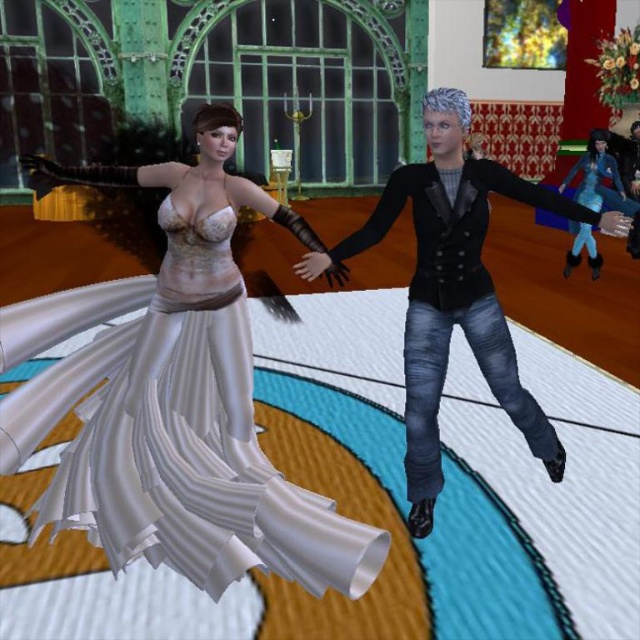
Between point (269, 557) and point (550, 436), which one is positioned behind?

Point (550, 436)

Image resolution: width=640 pixels, height=640 pixels. What do you see at coordinates (173, 397) in the screenshot?
I see `white satin dress at center` at bounding box center [173, 397].

The height and width of the screenshot is (640, 640). Identify the location of white satin dress at center. (173, 397).